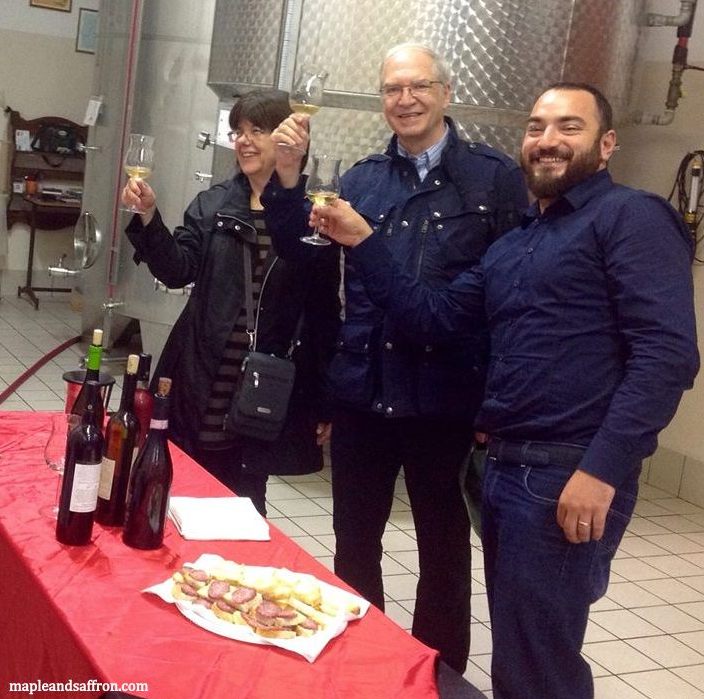
Locate an element on the screen. The image size is (704, 699). wine glasses is located at coordinates (305, 98), (322, 185), (137, 159).